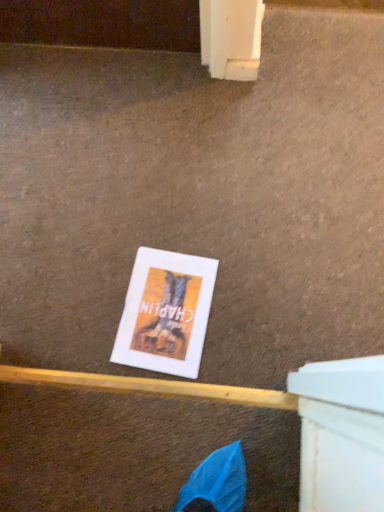
Where is `white paper poster at center`? The image size is (384, 512). white paper poster at center is located at coordinates (166, 312).

Measure the distance between point (125, 306) and camera.

A distance of 3.52 feet exists between point (125, 306) and camera.

The height and width of the screenshot is (512, 384). What do you see at coordinates (166, 312) in the screenshot?
I see `white paper poster at center` at bounding box center [166, 312].

What is the approximate height of white paper poster at center?

The height of white paper poster at center is 0.69 inches.

Find the location of a particular element. white paper poster at center is located at coordinates (166, 312).